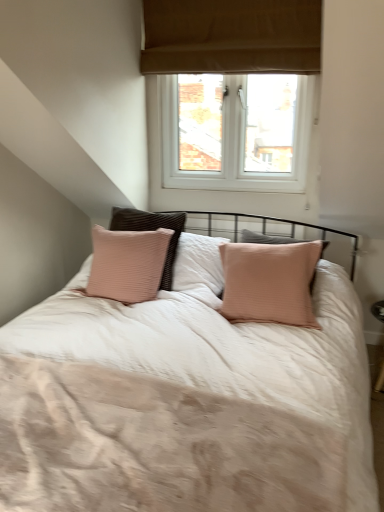
Question: Considering the relative sizes of light beige fabric bed at center and white plastic window at upper center in the image provided, is light beige fabric bed at center smaller than white plastic window at upper center?

Choices:
 (A) yes
 (B) no

Answer: (A)

Question: Is light beige fabric bed at center located outside white plastic window at upper center?

Choices:
 (A) no
 (B) yes

Answer: (B)

Question: Would you say light beige fabric bed at center is a long distance from white plastic window at upper center?

Choices:
 (A) yes
 (B) no

Answer: (A)

Question: From the image's perspective, is light beige fabric bed at center located above white plastic window at upper center?

Choices:
 (A) yes
 (B) no

Answer: (B)

Question: From a real-world perspective, is light beige fabric bed at center located beneath white plastic window at upper center?

Choices:
 (A) no
 (B) yes

Answer: (B)

Question: Does light beige fabric bed at center have a lesser height compared to white plastic window at upper center?

Choices:
 (A) no
 (B) yes

Answer: (B)

Question: From the image's perspective, would you say white plastic window at upper center is positioned over light beige fabric bed at center?

Choices:
 (A) no
 (B) yes

Answer: (B)

Question: Considering the relative sizes of white plastic window at upper center and light beige fabric bed at center in the image provided, is white plastic window at upper center shorter than light beige fabric bed at center?

Choices:
 (A) yes
 (B) no

Answer: (B)

Question: Is white plastic window at upper center further to the viewer compared to light beige fabric bed at center?

Choices:
 (A) no
 (B) yes

Answer: (B)

Question: Does white plastic window at upper center appear on the left side of light beige fabric bed at center?

Choices:
 (A) yes
 (B) no

Answer: (B)

Question: Can you confirm if white plastic window at upper center is taller than light beige fabric bed at center?

Choices:
 (A) yes
 (B) no

Answer: (A)

Question: Does white plastic window at upper center have a lesser width compared to light beige fabric bed at center?

Choices:
 (A) no
 (B) yes

Answer: (B)

Question: From a real-world perspective, relative to white plastic window at upper center, is light beige fabric bed at center vertically above or below?

Choices:
 (A) above
 (B) below

Answer: (B)